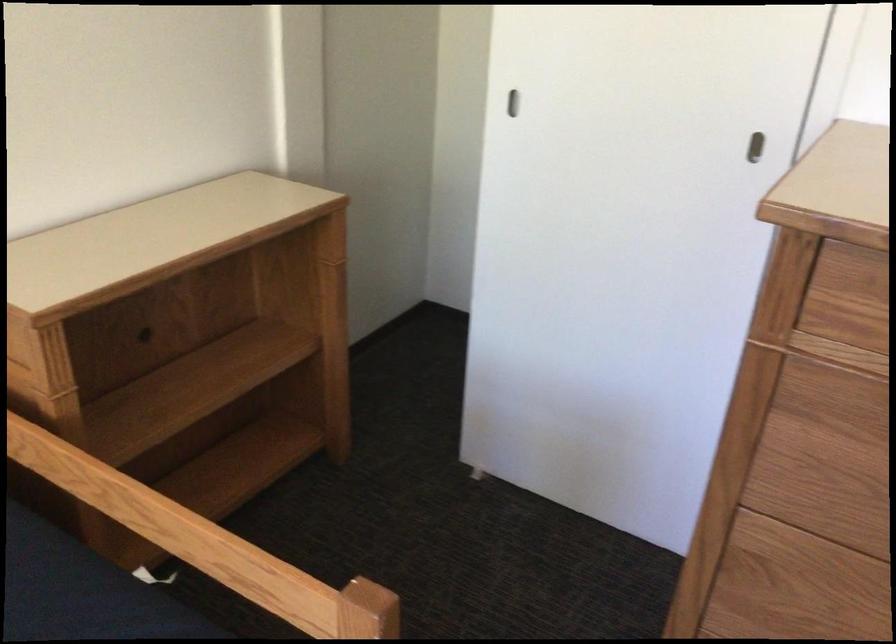
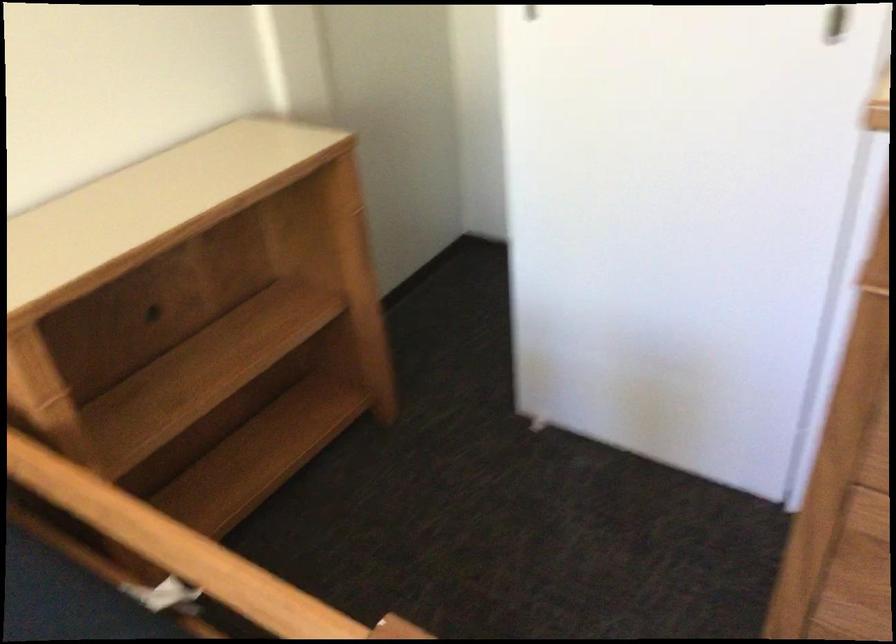
Question: The images are taken continuously from a first-person perspective. In which direction are you moving?

Choices:
 (A) Left
 (B) Right
 (C) Forward
 (D) Backward

Answer: (C)